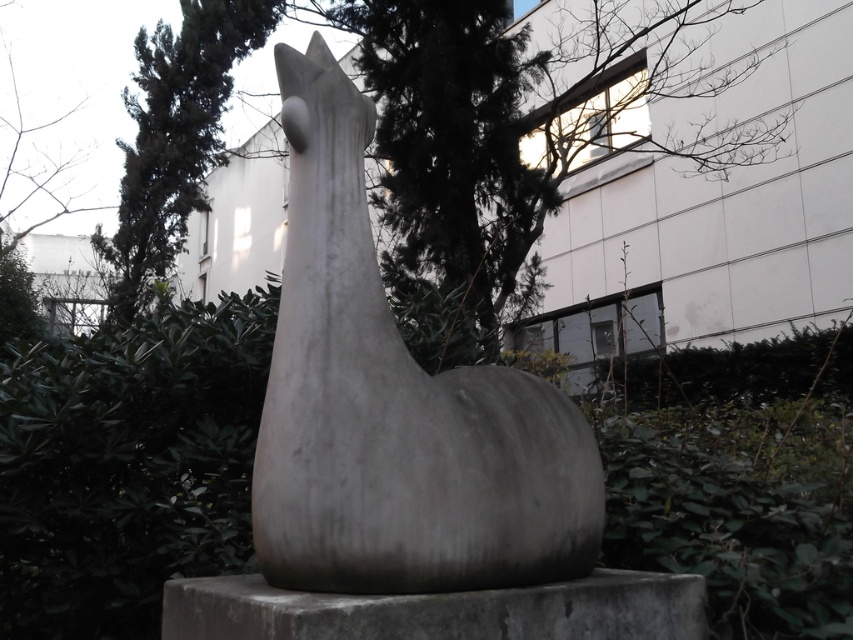
Question: Among these objects, which one is farthest from the camera?

Choices:
 (A) green leafy tree at upper center
 (B) white stone sculpture at center
 (C) green leafy tree at center
 (D) gray concrete at center

Answer: (A)

Question: Does white stone sculpture at center come behind green leafy tree at center?

Choices:
 (A) yes
 (B) no

Answer: (B)

Question: Is white stone sculpture at center positioned in front of green leafy tree at center?

Choices:
 (A) no
 (B) yes

Answer: (B)

Question: Which point is closer to the camera taking this photo?

Choices:
 (A) (573, 493)
 (B) (170, 93)

Answer: (A)

Question: Where is white stone sculpture at center located in relation to green leafy tree at upper center in the image?

Choices:
 (A) below
 (B) above

Answer: (A)

Question: Which is farther from the green leafy tree at center?

Choices:
 (A) white stone sculpture at center
 (B) green leafy tree at upper center
 (C) gray concrete at center

Answer: (C)